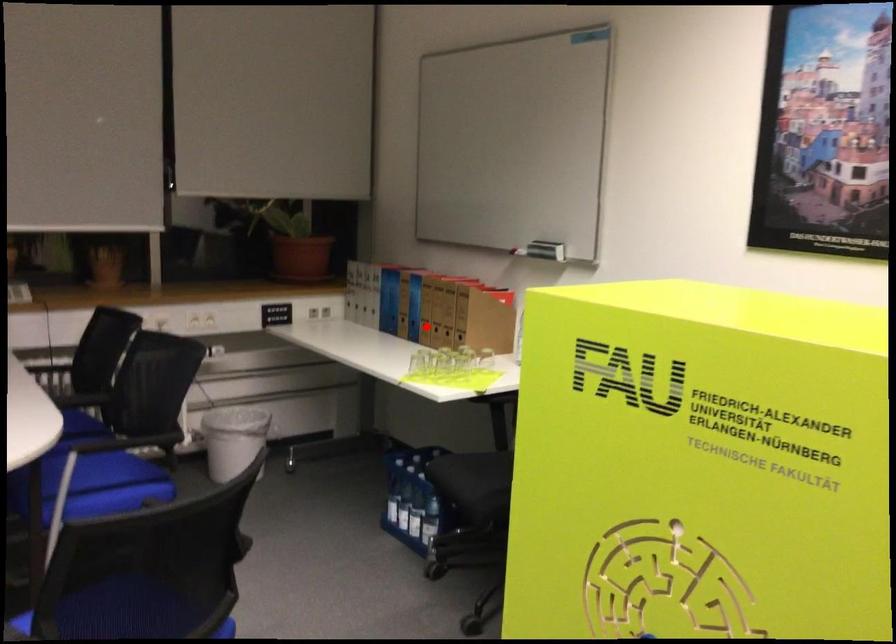
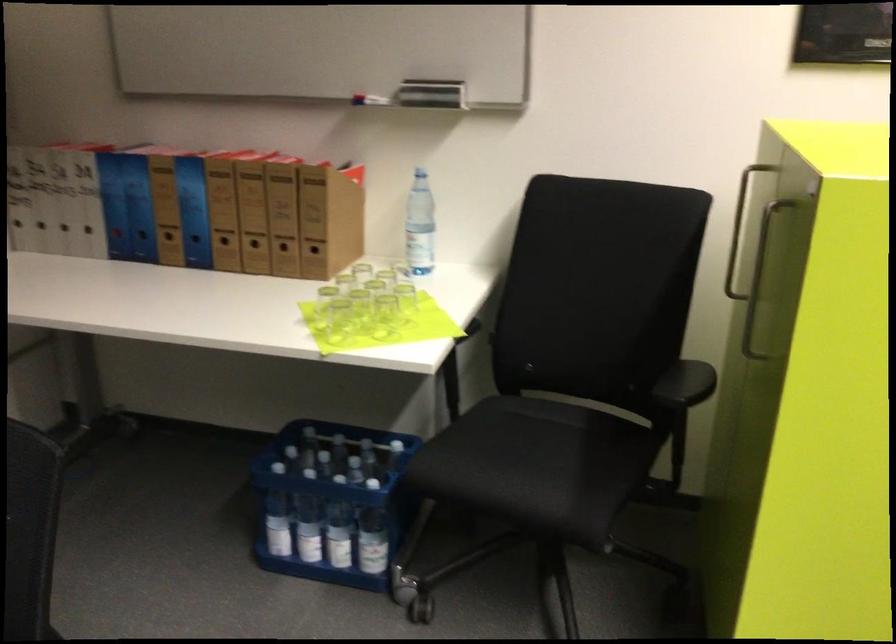
Question: I am providing you with two images of the same scene from different viewpoints. In image1, a red point is highlighted. Considering the same 3D point in image2, which of the following is correct?

Choices:
 (A) It is closer
 (B) It is farther

Answer: (A)